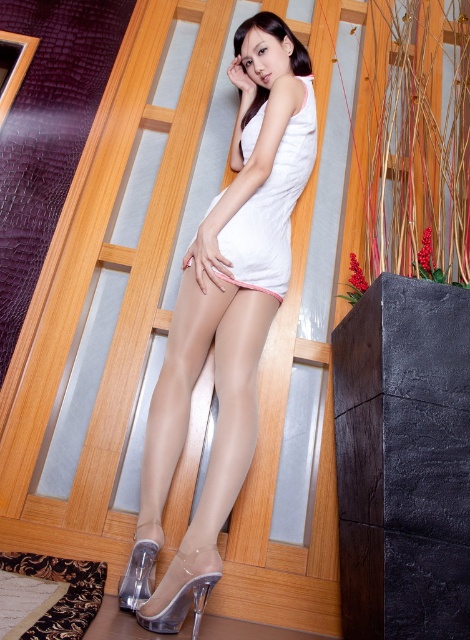
Question: Which of the following is the farthest from the observer?

Choices:
 (A) (279, 289)
 (B) (289, 224)

Answer: (B)

Question: Observing the image, what is the correct spatial positioning of white fabric dress at center in reference to clear plastic high-heeled shoe at lower center?

Choices:
 (A) above
 (B) below

Answer: (A)

Question: Where is matte white dress at center located in relation to transparent plastic high-heeled shoe at lower center in the image?

Choices:
 (A) right
 (B) left

Answer: (A)

Question: Which object is the closest to the clear plastic high-heeled shoe at lower center?

Choices:
 (A) transparent plastic high-heeled shoe at lower center
 (B) pink fabric at center

Answer: (A)

Question: Can you confirm if matte white dress at center is positioned above clear plastic high-heeled shoe at lower center?

Choices:
 (A) no
 (B) yes

Answer: (B)

Question: Which object is positioned closest to the pink fabric at center?

Choices:
 (A) clear plastic high-heeled shoe at lower center
 (B) white fabric dress at center
 (C) transparent plastic high-heeled shoe at lower center
 (D) matte white dress at center

Answer: (B)